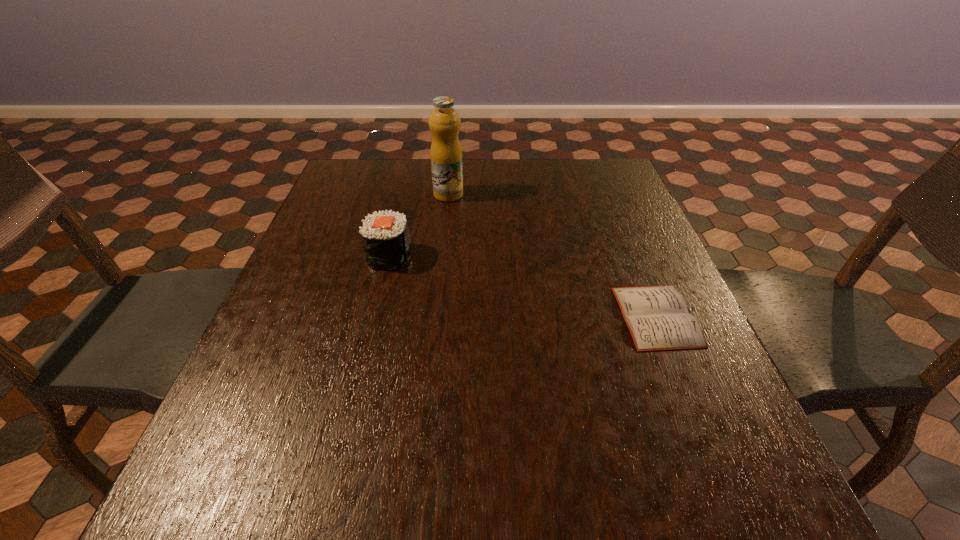
Find the location of a particular element. vacant space that satisfies the following two spatial constraints: 1. on the front side of the second tallest object; 2. on the right side of the diary is located at coordinates (374, 316).

The width and height of the screenshot is (960, 540). I want to click on free space in the image that satisfies the following two spatial constraints: 1. on the front label of the second object from left to right; 2. on the back side of the shortest object, so click(436, 316).

Find the location of a particular element. The height and width of the screenshot is (540, 960). free space that satisfies the following two spatial constraints: 1. on the front side of the shortest object; 2. on the right side of the second farthest object is located at coordinates (374, 316).

Where is `vacant region that satisfies the following two spatial constraints: 1. on the front label of the second object from right to left; 2. on the left side of the nearest object`? vacant region that satisfies the following two spatial constraints: 1. on the front label of the second object from right to left; 2. on the left side of the nearest object is located at coordinates (436, 316).

At what (x,y) coordinates should I click in order to perform the action: click on free space that satisfies the following two spatial constraints: 1. on the front label of the farthest object; 2. on the left side of the diary. Please return your answer as a coordinate pair (x, y). This screenshot has height=540, width=960. Looking at the image, I should click on (436, 316).